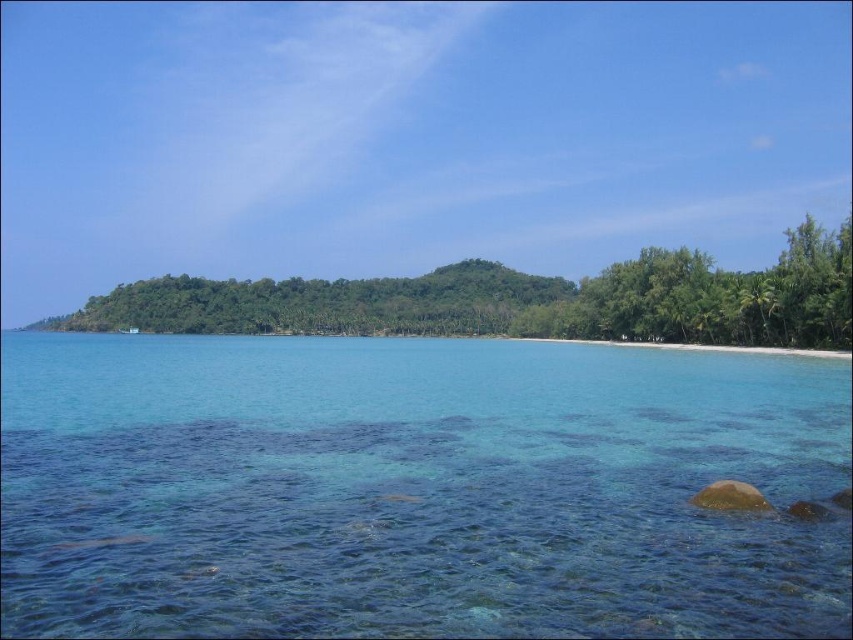
You are planning to paint a coastal landscape and want to ensure the clear blue water at center and the green leafy trees at center are proportionally accurate. Based on the scene, which of these two elements takes up more space in the image?

The green leafy trees at center occupy more space than the clear blue water at center in the image.

You are a photographer standing at the shoreline in the coastal scene. You want to take a photo that includes both point (469, 593) and point (97, 330). Which point will appear larger in the photo?

Point (469, 593) will appear larger in the photo because it is closer to the camera than point (97, 330).